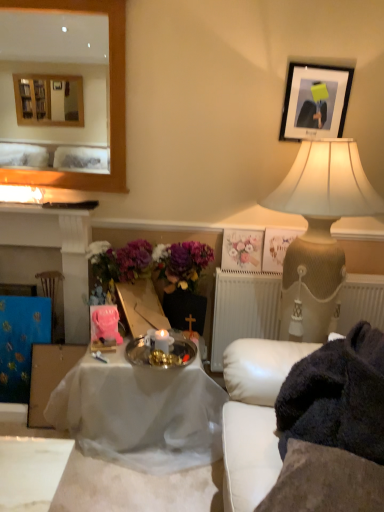
Question: Does beige textured lamp at upper right have a lesser height compared to matte black fireplace at left?

Choices:
 (A) yes
 (B) no

Answer: (B)

Question: Considering the relative sizes of beige textured lamp at upper right and matte black fireplace at left in the image provided, is beige textured lamp at upper right thinner than matte black fireplace at left?

Choices:
 (A) yes
 (B) no

Answer: (B)

Question: Is beige textured lamp at upper right smaller than matte black fireplace at left?

Choices:
 (A) no
 (B) yes

Answer: (A)

Question: Is beige textured lamp at upper right in front of matte black fireplace at left?

Choices:
 (A) no
 (B) yes

Answer: (B)

Question: Could you tell me if beige textured lamp at upper right is facing matte black fireplace at left?

Choices:
 (A) no
 (B) yes

Answer: (A)

Question: Considering their positions, is white cloth-covered table at center located in front of or behind beige textured lamp at upper right?

Choices:
 (A) behind
 (B) front

Answer: (A)

Question: Would you say white cloth-covered table at center is to the left or to the right of beige textured lamp at upper right in the picture?

Choices:
 (A) right
 (B) left

Answer: (B)

Question: Considering the positions of white cloth-covered table at center and beige textured lamp at upper right in the image, is white cloth-covered table at center wider or thinner than beige textured lamp at upper right?

Choices:
 (A) wide
 (B) thin

Answer: (A)

Question: Is white cloth-covered table at center taller or shorter than beige textured lamp at upper right?

Choices:
 (A) short
 (B) tall

Answer: (A)

Question: Looking at their shapes, would you say white leather couch at right is wider or thinner than black matte picture frame at upper right, the 1th picture frame in the front-to-back sequence?

Choices:
 (A) wide
 (B) thin

Answer: (A)

Question: From the image's perspective, relative to black matte picture frame at upper right, which ranks as the 2th picture frame in bottom-to-top order, is white leather couch at right above or below?

Choices:
 (A) below
 (B) above

Answer: (A)

Question: In the image, is white leather couch at right positioned in front of or behind black matte picture frame at upper right, the 1th picture frame in the front-to-back sequence?

Choices:
 (A) front
 (B) behind

Answer: (A)

Question: From a real-world perspective, is white leather couch at right above or below black matte picture frame at upper right, which ranks as the 2th picture frame in bottom-to-top order?

Choices:
 (A) below
 (B) above

Answer: (A)

Question: From a real-world perspective, relative to pastel floral print at upper center, is silver metallic tray at center vertically above or below?

Choices:
 (A) below
 (B) above

Answer: (A)

Question: Relative to pastel floral print at upper center, is silver metallic tray at center in front or behind?

Choices:
 (A) front
 (B) behind

Answer: (A)